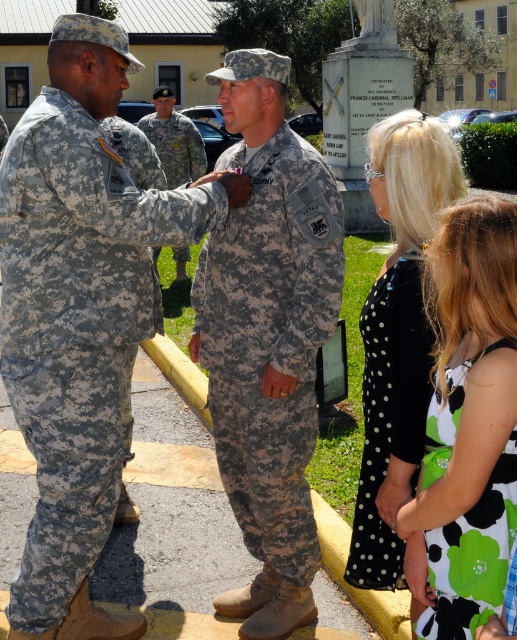
Question: Which point is closer to the camera?

Choices:
 (A) camouflage uniform at center
 (B) camouflage fabric uniform at left
 (C) green floral dress at center
 (D) black dotted dress at center

Answer: (C)

Question: Among these objects, which one is nearest to the camera?

Choices:
 (A) camouflage uniform at center
 (B) camouflage fabric uniform at left
 (C) black dotted dress at center

Answer: (C)

Question: Which of the following is the closest to the observer?

Choices:
 (A) camouflage uniform at center
 (B) camouflage fabric uniform at center
 (C) camouflage fabric uniform at left
 (D) black dotted dress at center

Answer: (D)

Question: Can you confirm if camouflage fabric uniform at left is thinner than green floral dress at center?

Choices:
 (A) no
 (B) yes

Answer: (A)

Question: Can you confirm if camouflage fabric uniform at left is smaller than green floral dress at center?

Choices:
 (A) no
 (B) yes

Answer: (A)

Question: Can you confirm if camouflage fabric uniform at left is bigger than camouflage uniform at center?

Choices:
 (A) no
 (B) yes

Answer: (A)